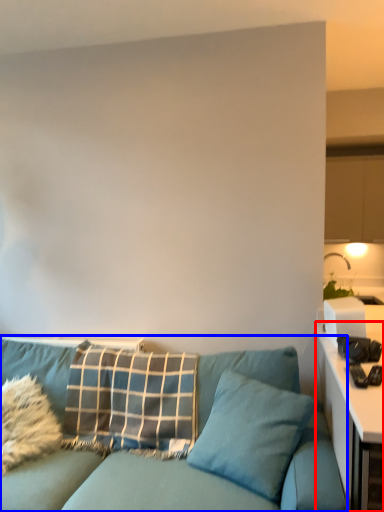
Question: Among these objects, which one is farthest to the camera, table (highlighted by a red box) or studio couch (highlighted by a blue box)?

Choices:
 (A) table
 (B) studio couch

Answer: (B)